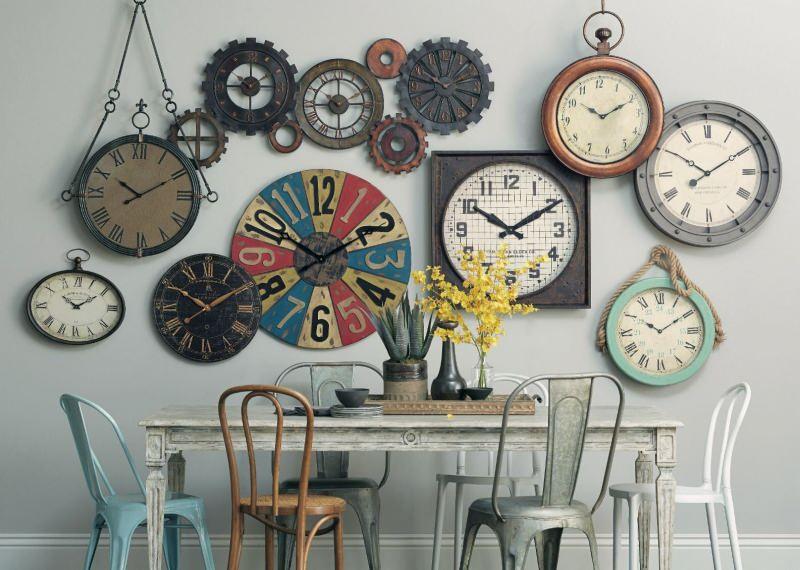
Find the location of `clocks with arabic numerals`. clocks with arabic numerals is located at coordinates (317, 242), (504, 246), (602, 140), (432, 89).